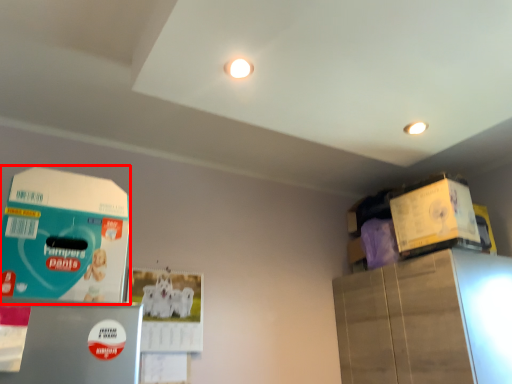
Question: Considering the relative positions of box (annotated by the red box) and box in the image provided, where is box (annotated by the red box) located with respect to the staircase?

Choices:
 (A) left
 (B) right

Answer: (A)